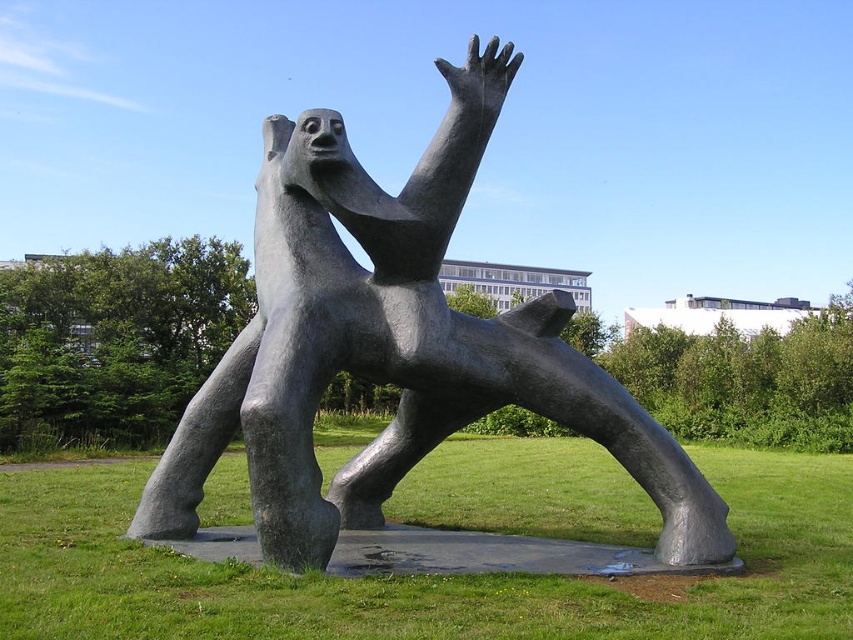
Question: Is polished bronze sculpture at center thinner than green grass at center?

Choices:
 (A) yes
 (B) no

Answer: (A)

Question: Is polished bronze sculpture at center smaller than green grass at center?

Choices:
 (A) no
 (B) yes

Answer: (B)

Question: Which point is closer to the camera taking this photo?

Choices:
 (A) (152, 520)
 (B) (439, 589)

Answer: (B)

Question: Does polished bronze sculpture at center have a lesser width compared to green grass at center?

Choices:
 (A) yes
 (B) no

Answer: (A)